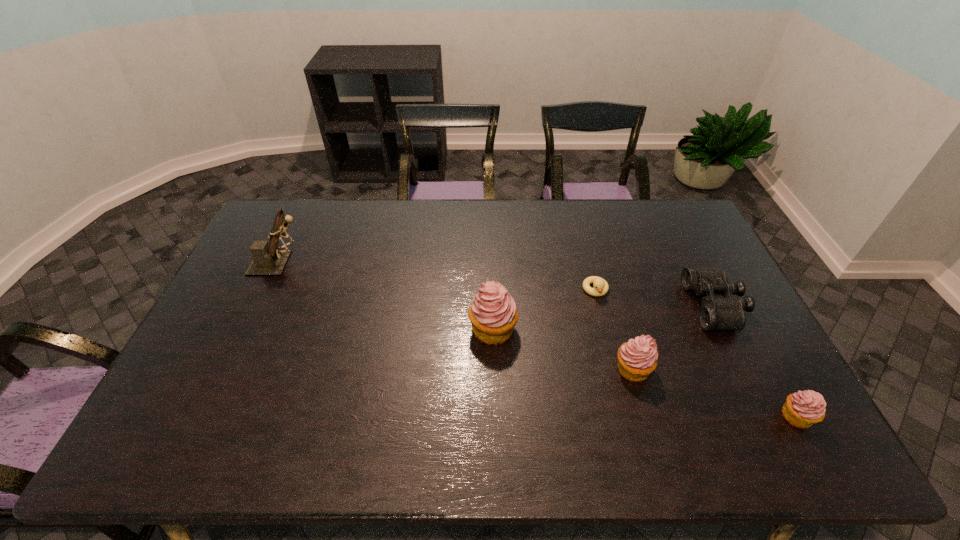
You are a GUI agent. You are given a task and a screenshot of the screen. Output one action in this format:
    pyautogui.click(x=<x>, y=<y>)
    Task: Click on the vacant point located on the left of the tallest cupcake
    
    Given the screenshot: What is the action you would take?
    pyautogui.click(x=442, y=329)

Identify the location of free location located 0.160m on the back of the second tallest cupcake. This screenshot has height=540, width=960. (615, 309).

This screenshot has width=960, height=540. I want to click on blank space located 0.140m on the back of the shortest cupcake, so click(764, 355).

Locate an element on the screen. This screenshot has height=540, width=960. vacant position located at the eyepieces of the binoculars is located at coordinates (610, 306).

Where is `free space located at the eyepieces of the binoculars`? The height and width of the screenshot is (540, 960). free space located at the eyepieces of the binoculars is located at coordinates (619, 306).

This screenshot has height=540, width=960. Identify the location of free location located at the eyepieces of the binoculars. 577,306.

The width and height of the screenshot is (960, 540). I want to click on free space located on the front-facing side of the tallest object, so click(416, 263).

The height and width of the screenshot is (540, 960). Find the location of `vacant space positioned 0.140m at the beak of the duckling`. vacant space positioned 0.140m at the beak of the duckling is located at coordinates (608, 337).

You are a GUI agent. You are given a task and a screenshot of the screen. Output one action in this format:
    pyautogui.click(x=<x>, y=<y>)
    Task: Click on the object that is positioned at the left edge
    The image size is (960, 540).
    Given the screenshot: What is the action you would take?
    pyautogui.click(x=269, y=259)

This screenshot has height=540, width=960. Find the location of `cupcake that is at the right edge`. cupcake that is at the right edge is located at coordinates (802, 409).